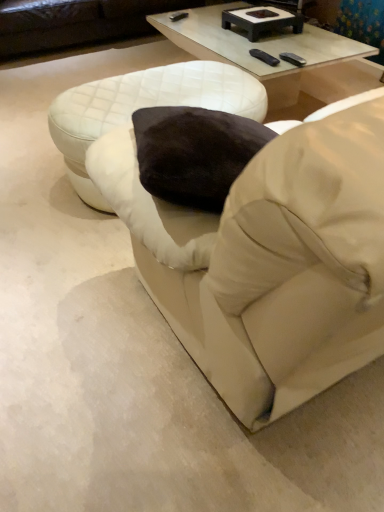
Where is `clear glass coffee table at upper center`? This screenshot has width=384, height=512. clear glass coffee table at upper center is located at coordinates (278, 56).

Measure the distance between black rubber remote at upper right and camera.

The depth of black rubber remote at upper right is 2.17 meters.

Measure the distance between white quilted ottoman at center and camera.

white quilted ottoman at center and camera are 1.63 meters apart from each other.

Where is `matte white studio couch at upper center`? matte white studio couch at upper center is located at coordinates (75, 23).

Where is `beige fabric bean bag chair at center`? beige fabric bean bag chair at center is located at coordinates (270, 255).

Is black matte rectangular tray at upper center in front of or behind white quilted ottoman at center in the image?

Visually, black matte rectangular tray at upper center is located behind white quilted ottoman at center.

Considering the sizes of objects black matte rectangular tray at upper center and white quilted ottoman at center in the image provided, who is thinner, black matte rectangular tray at upper center or white quilted ottoman at center?

Thinner between the two is black matte rectangular tray at upper center.

Can you confirm if black matte rectangular tray at upper center is smaller than white quilted ottoman at center?

Indeed, black matte rectangular tray at upper center has a smaller size compared to white quilted ottoman at center.

Can you tell me how much black matte rectangular tray at upper center and white quilted ottoman at center differ in facing direction?

There is a 87.5-degree angle between the facing directions of black matte rectangular tray at upper center and white quilted ottoman at center.

Is point (276, 59) positioned in front of point (186, 102)?

No, it is not.

There is a white quilted ottoman at center. Identify the location of pad above it (from a real-world perspective). The height and width of the screenshot is (512, 384). (264, 57).

Between black rubber remote at upper right and white quilted ottoman at center, which one has more height?

white quilted ottoman at center.

Is black rubber remote at upper right not close to white quilted ottoman at center?

No, black rubber remote at upper right is not far away from white quilted ottoman at center.

Is beige fabric bean bag chair at center not near matte white studio couch at upper center?

beige fabric bean bag chair at center is positioned a significant distance from matte white studio couch at upper center.

Could matte white studio couch at upper center be considered to be inside beige fabric bean bag chair at center?

No, beige fabric bean bag chair at center does not contain matte white studio couch at upper center.

From the picture: Between beige fabric bean bag chair at center and matte white studio couch at upper center, which one appears on the left side from the viewer's perspective?

Positioned to the left is matte white studio couch at upper center.

Which of these two, beige fabric bean bag chair at center or matte white studio couch at upper center, stands taller?

Standing taller between the two is beige fabric bean bag chair at center.

From the image's perspective, which object appears higher, beige fabric bean bag chair at center or clear glass coffee table at upper center?

From the image's view, clear glass coffee table at upper center is above.

This screenshot has height=512, width=384. Identify the location of coffee table on the left of beige fabric bean bag chair at center. (278, 56).

Is beige fabric bean bag chair at center situated inside clear glass coffee table at upper center or outside?

beige fabric bean bag chair at center is spatially situated outside clear glass coffee table at upper center.

Locate an element on the screen. table that is in front of the black rubber remote at upper right is located at coordinates (144, 106).

From a real-world perspective, who is located lower, white quilted ottoman at center or black rubber remote at upper right?

white quilted ottoman at center is physically lower.

Is white quilted ottoman at center aimed at black rubber remote at upper right?

No, white quilted ottoman at center is not aimed at black rubber remote at upper right.

Does white quilted ottoman at center touch black rubber remote at upper right?

No, white quilted ottoman at center is not in contact with black rubber remote at upper right.

Is matte white studio couch at upper center not inside beige fabric bean bag chair at center?

Yes, matte white studio couch at upper center is located beyond the bounds of beige fabric bean bag chair at center.

From a real-world perspective, is matte white studio couch at upper center located beneath beige fabric bean bag chair at center?

Yes.

Is matte white studio couch at upper center to the right of beige fabric bean bag chair at center from the viewer's perspective?

No.

Is matte white studio couch at upper center aimed at beige fabric bean bag chair at center?

Yes, matte white studio couch at upper center is turned towards beige fabric bean bag chair at center.

Is clear glass coffee table at upper center turned away from white quilted ottoman at center?

No.

Would you say clear glass coffee table at upper center is a long distance from white quilted ottoman at center?

They are positioned close to each other.

Considering the positions of objects clear glass coffee table at upper center and white quilted ottoman at center in the image provided, who is more to the right, clear glass coffee table at upper center or white quilted ottoman at center?

clear glass coffee table at upper center.

Who is shorter, clear glass coffee table at upper center or white quilted ottoman at center?

Standing shorter between the two is white quilted ottoman at center.

Locate an element on the screen. Image resolution: width=384 pixels, height=512 pixels. table that is under the black matte rectangular tray at upper center (from a real-world perspective) is located at coordinates (144, 106).

I want to click on pad located behind the white quilted ottoman at center, so click(x=264, y=57).

Looking at the image, which one is located closer to white quilted ottoman at center, black rubber remote at upper right or black matte rectangular tray at upper center?

black rubber remote at upper right lies closer to white quilted ottoman at center than the other object.

Looking at this image, which object lies further to the anchor point black rubber remote at upper right, beige fabric bean bag chair at center or clear glass coffee table at upper center?

beige fabric bean bag chair at center is positioned further to the anchor black rubber remote at upper right.

Based on their spatial positions, is black matte rectangular tray at upper center or white quilted ottoman at center further from beige fabric bean bag chair at center?

black matte rectangular tray at upper center.

Looking at the image, which one is located further to beige fabric bean bag chair at center, white quilted ottoman at center or clear glass coffee table at upper center?

Based on the image, clear glass coffee table at upper center appears to be further to beige fabric bean bag chair at center.

From the image, which object appears to be farther from matte white studio couch at upper center, beige fabric bean bag chair at center or black matte rectangular tray at upper center?

beige fabric bean bag chair at center.

Based on their spatial positions, is white quilted ottoman at center or beige fabric bean bag chair at center further from black rubber remote at upper right?

Among the two, beige fabric bean bag chair at center is located further to black rubber remote at upper right.

From the image, which object appears to be farther from matte white studio couch at upper center, black matte rectangular tray at upper center or black rubber remote at upper right?

Among the two, black rubber remote at upper right is located further to matte white studio couch at upper center.

In the scene shown: Based on their spatial positions, is black rubber remote at upper right or matte white studio couch at upper center closer to beige fabric bean bag chair at center?

Among the two, black rubber remote at upper right is located nearer to beige fabric bean bag chair at center.

You are a GUI agent. You are given a task and a screenshot of the screen. Output one action in this format:
    pyautogui.click(x=<x>, y=<y>)
    Task: Click on the round table between matte white studio couch at upper center and white quilted ottoman at center in the up-down direction
    This screenshot has width=384, height=512.
    Given the screenshot: What is the action you would take?
    pyautogui.click(x=262, y=20)

You are a GUI agent. You are given a task and a screenshot of the screen. Output one action in this format:
    pyautogui.click(x=<x>, y=<y>)
    Task: Click on the coffee table situated between matte white studio couch at upper center and black matte rectangular tray at upper center from left to right
    The image size is (384, 512).
    Given the screenshot: What is the action you would take?
    pyautogui.click(x=278, y=56)

Find the location of a particular element. coffee table between matte white studio couch at upper center and white quilted ottoman at center from top to bottom is located at coordinates (278, 56).

Where is `table between beige fabric bean bag chair at center and clear glass coffee table at upper center along the z-axis`? The width and height of the screenshot is (384, 512). table between beige fabric bean bag chair at center and clear glass coffee table at upper center along the z-axis is located at coordinates (144, 106).